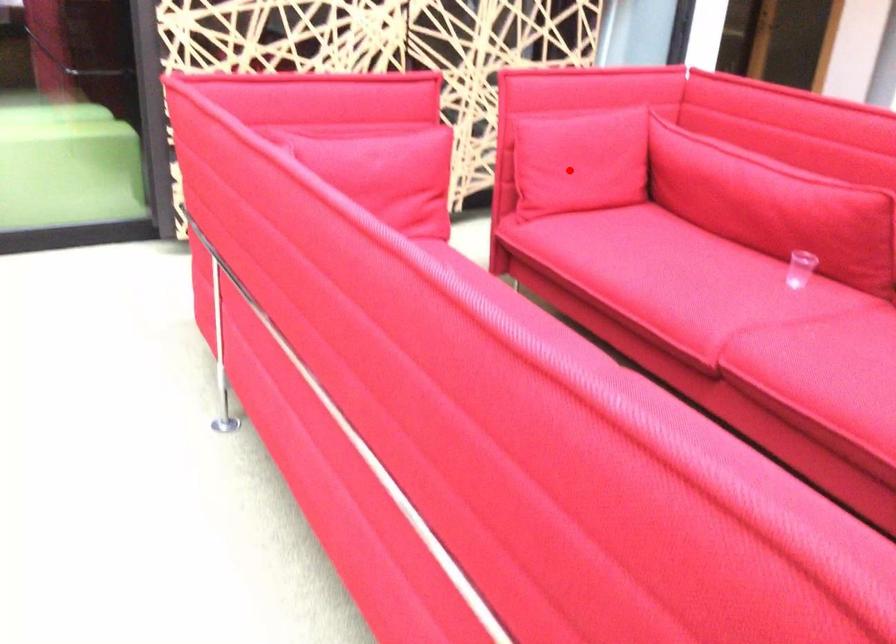
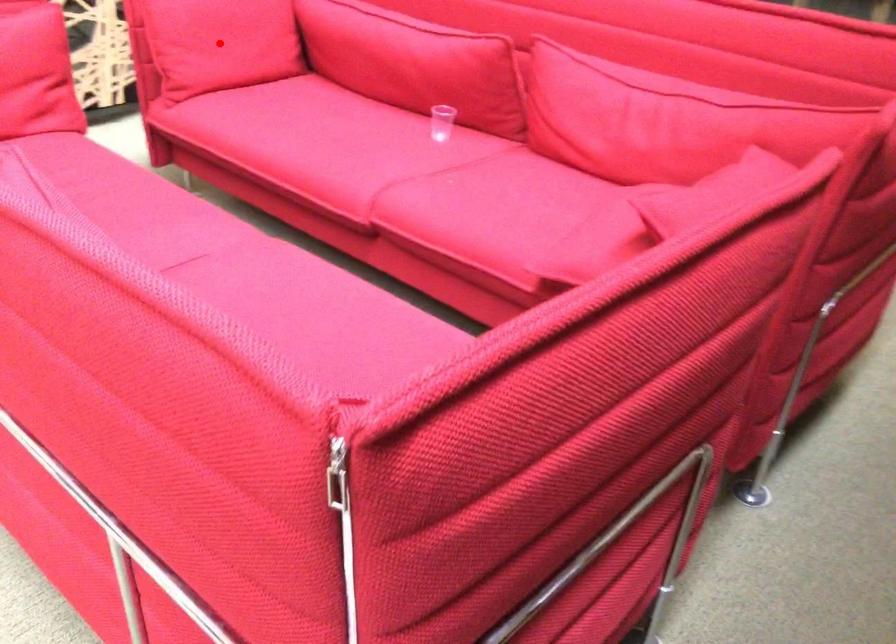
I am providing you with two images of the same scene from different viewpoints. A red point is marked on the first image and another point is marked on the second image. Do the highlighted points in image1 and image2 indicate the same real-world spot?

Yes